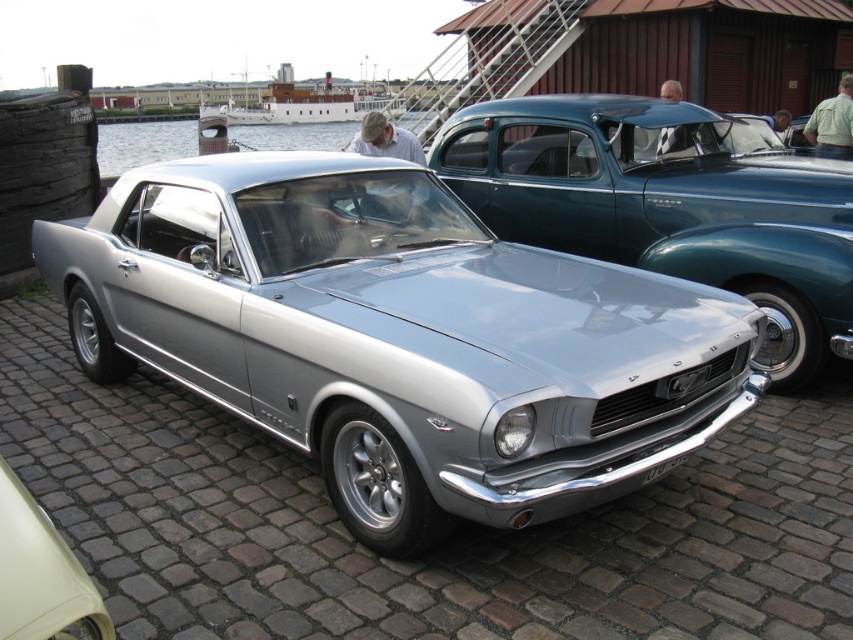
Question: Estimate the real-world distances between objects in this image. Which object is closer to the light yellow plastic car at center?

Choices:
 (A) satin silver car at center
 (B) white plastic license plate at lower center
 (C) white wooden boat at upper center

Answer: (B)

Question: Does light yellow plastic car at center have a larger size compared to white plastic license plate at lower center?

Choices:
 (A) no
 (B) yes

Answer: (B)

Question: Which of the following is the closest to the observer?

Choices:
 (A) (608, 157)
 (B) (608, 474)
 (C) (679, 456)

Answer: (B)

Question: Does satin silver car at center lie behind white plastic license plate at lower center?

Choices:
 (A) no
 (B) yes

Answer: (B)

Question: Does silver metallic car at center lie behind satin silver car at center?

Choices:
 (A) no
 (B) yes

Answer: (A)

Question: Among these points, which one is nearest to the camera?

Choices:
 (A) (393, 484)
 (B) (32, 509)
 (C) (660, 474)

Answer: (B)